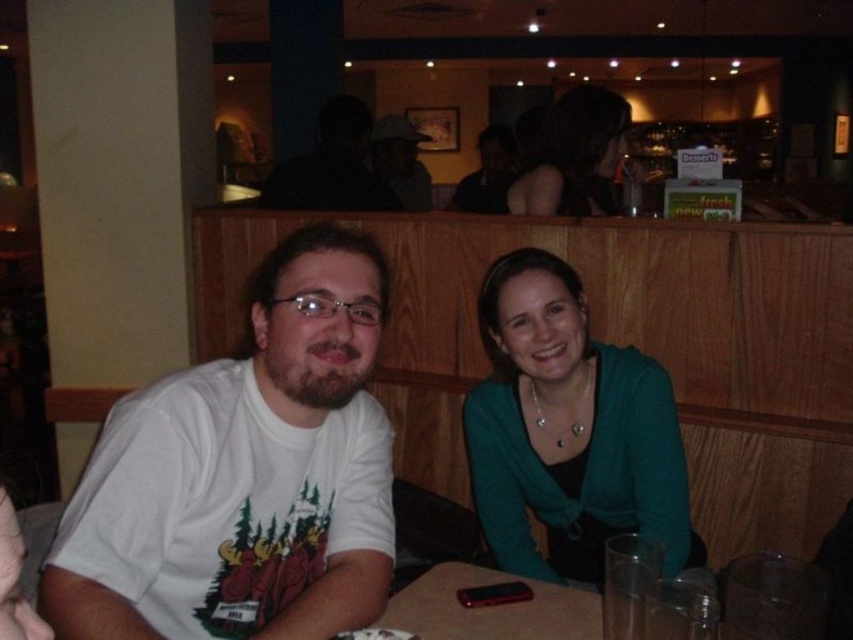
You are a photographer standing 10 feet away from the teal sweater at center and the matte black shirt at center. Can you fit both items in your camera frame if your camera has a maximum field of view of 8 feet?

The teal sweater at center and matte black shirt at center are 9.00 feet apart from each other. Since the camera has a maximum field of view of 8 feet, the photographer cannot fit both items in the frame as the distance between them exceeds the camera field of view.